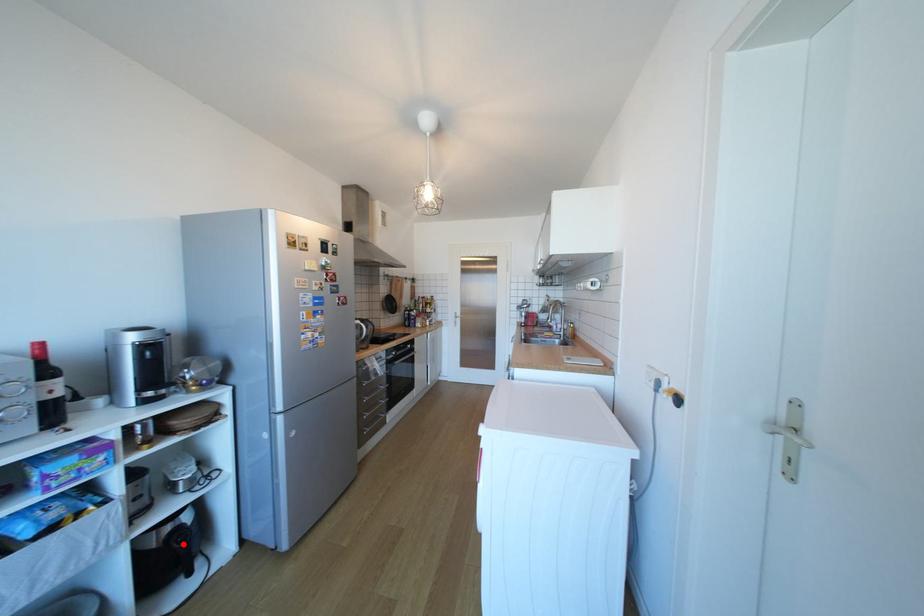
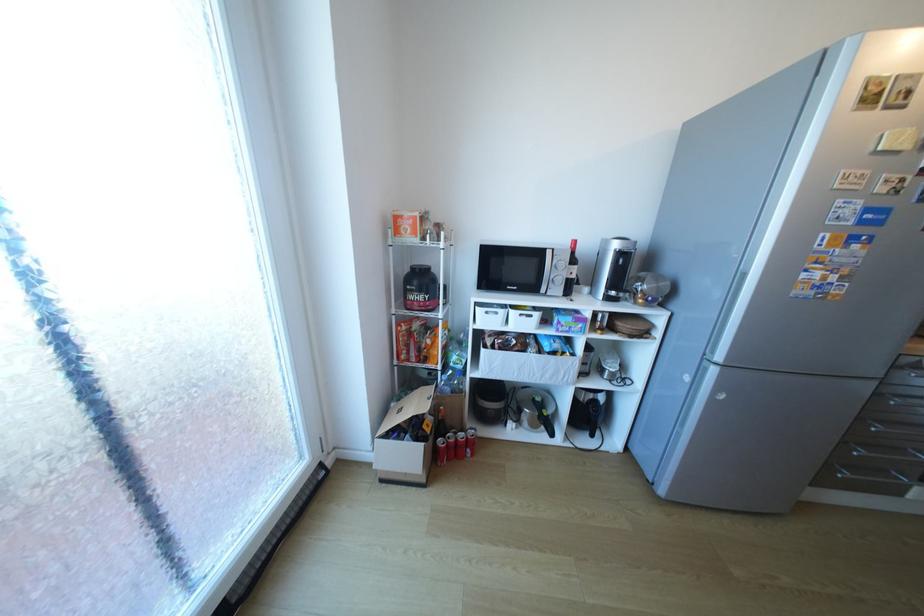
Question: I am providing you with two images of the same scene from different viewpoints. Given a red point in image1, look at the same physical point in image2. Is it:

Choices:
 (A) Closer to the viewpoint
 (B) Farther from the viewpoint

Answer: (B)